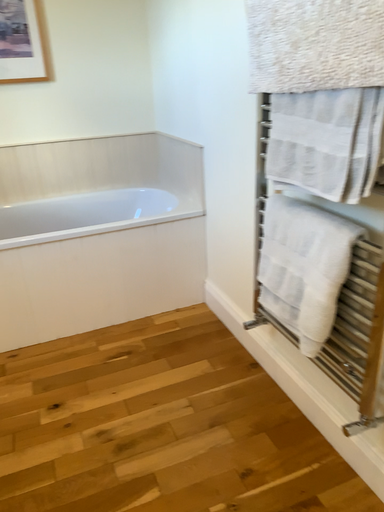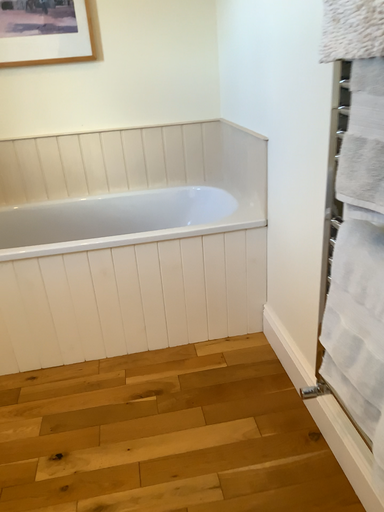
Question: Which way did the camera rotate in the video?

Choices:
 (A) rotated left
 (B) rotated right

Answer: (A)